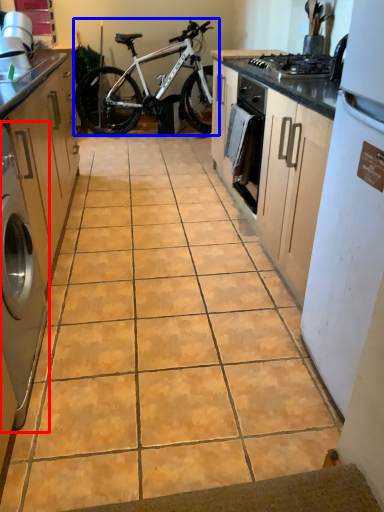
Question: Which point is further to the camera, home appliance (highlighted by a red box) or bicycle (highlighted by a blue box)?

Choices:
 (A) home appliance
 (B) bicycle

Answer: (B)